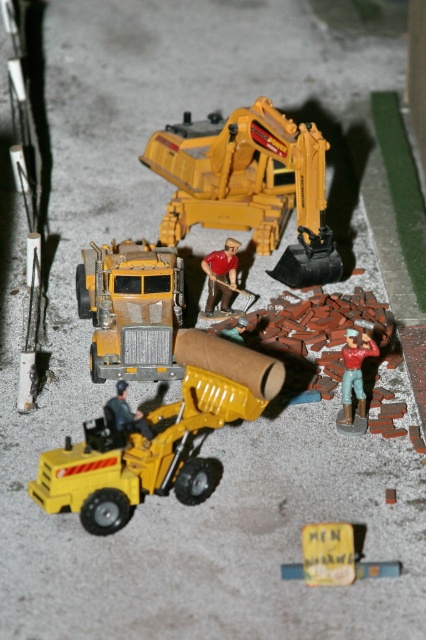
You are a toy collector examining the miniature construction scene. You notice the matte yellow truck at center and the matte red construction worker at center right. Which object is taller?

The matte yellow truck at center is taller than the matte red construction worker at center right.

You are a toy figure standing at the origin point of the coordinate system. You want to move to the yellow rubber toy truck at center. What direction should you move in?

Since the yellow rubber toy truck at center is located at coordinate point 0.684 on the x axis and 0.371 on the y axis, you should move northeast to reach it.

You are a toy collector who wants to place a new toy figure between the yellow rubber toy truck at center and the metallic yellow construction worker at center. The new toy is 3.5 inches wide. Will there be enough space between them to fit the new toy?

The yellow rubber toy truck at center and the metallic yellow construction worker at center are 3.49 inches apart from each other. Since the new toy is 3.5 inches wide, there is not enough space to fit it between them.